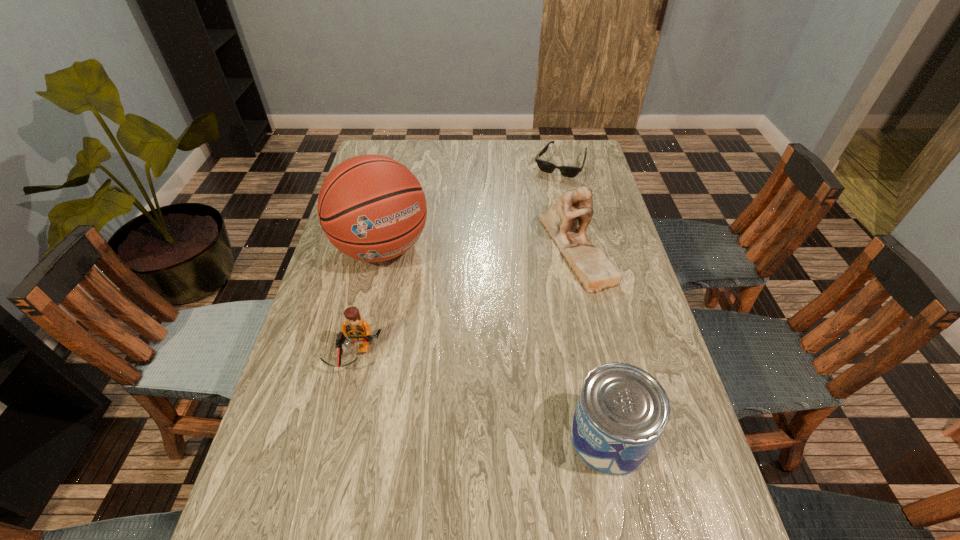
The image size is (960, 540). I want to click on free space located 0.270m on the logo side of the basketball, so click(445, 344).

Locate an element on the screen. object at the far edge is located at coordinates (568, 171).

Locate an element on the screen. object at the near edge is located at coordinates (622, 410).

The width and height of the screenshot is (960, 540). I want to click on Lego that is at the left edge, so click(358, 331).

Where is `basketball that is at the left edge`? Image resolution: width=960 pixels, height=540 pixels. basketball that is at the left edge is located at coordinates (372, 208).

I want to click on can at the right edge, so click(x=622, y=410).

Identify the location of figurine located at the right edge. The height and width of the screenshot is (540, 960). (591, 266).

Identify the location of sunglasses that is at the right edge. (568, 171).

Image resolution: width=960 pixels, height=540 pixels. In order to click on object present at the far right corner in this screenshot , I will do `click(568, 171)`.

You are a GUI agent. You are given a task and a screenshot of the screen. Output one action in this format:
    pyautogui.click(x=<x>, y=<y>)
    Task: Click on the object that is at the near right corner
    This screenshot has height=540, width=960.
    Given the screenshot: What is the action you would take?
    pyautogui.click(x=622, y=410)